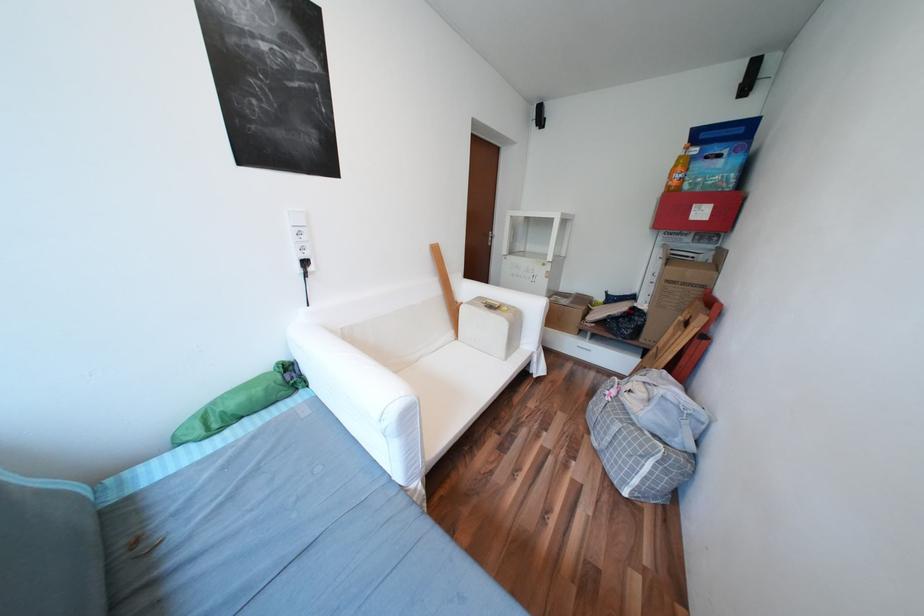
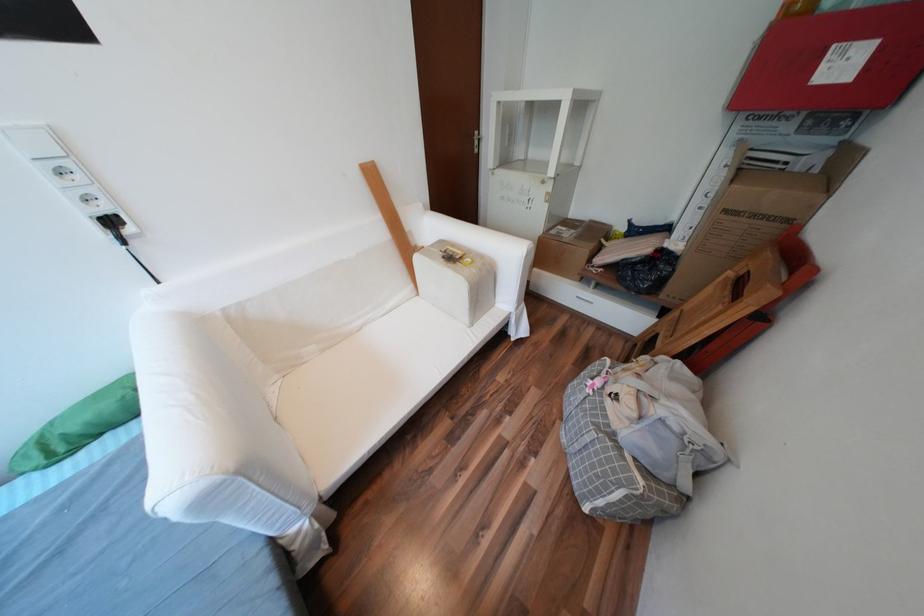
In the second image, find the point that corresponds to point 320,270 in the first image.

(138, 231)